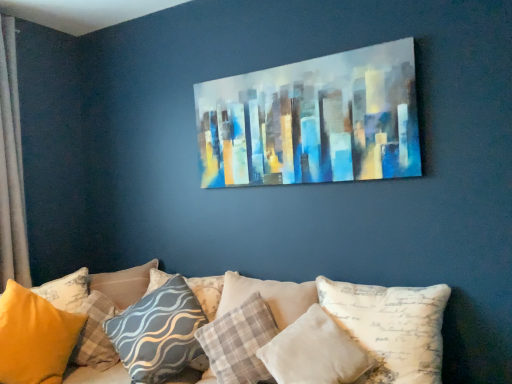
Question: From a real-world perspective, is white velvety pillow at center, arranged as the 6th pillow when viewed from the left, physically located above or below matte yellow pillow at lower left, placed as the first pillow when sorted from left to right?

Choices:
 (A) above
 (B) below

Answer: (B)

Question: Is white velvety pillow at center, the second pillow when ordered from right to left, wider or thinner than matte yellow pillow at lower left, acting as the seventh pillow starting from the right?

Choices:
 (A) thin
 (B) wide

Answer: (A)

Question: Estimate the real-world distances between objects in this image. Which object is farther from the abstract acrylic cityscape at upper center?

Choices:
 (A) textured gray pillow at center, the 3th pillow viewed from the left
 (B) yellow fabric pillow at lower left, which ranks as the second pillow in left-to-right order
 (C) matte yellow pillow at lower left, placed as the first pillow when sorted from left to right
 (D) silky beige curtain at left
 (E) plaid fabric pillow at center, acting as the third pillow starting from the right

Answer: (D)

Question: Which object is the closest to the abstract acrylic cityscape at upper center?

Choices:
 (A) yellow fabric pillow at lower left, placed as the sixth pillow when sorted from right to left
 (B) white fabric pillow at center, the seventh pillow viewed from the left
 (C) matte yellow pillow at lower left, acting as the seventh pillow starting from the right
 (D) silky beige curtain at left
 (E) white velvety pillow at center, the second pillow when ordered from right to left

Answer: (B)